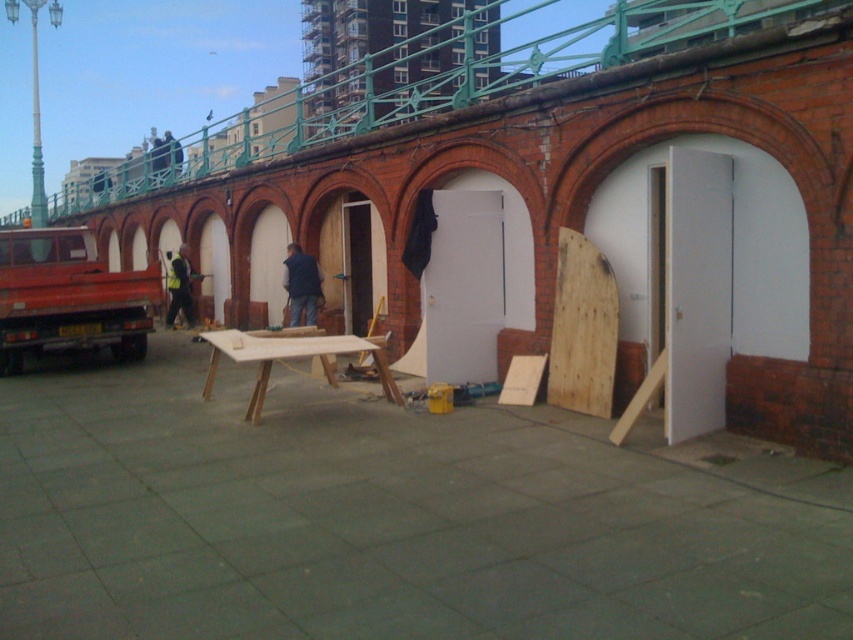
You are a construction worker who just arrived at the site and need to locate your safety gear. You see the dark blue jacket at center and the reflective yellow safety vest at center. Which item is positioned to the right of the other?

The dark blue jacket at center is to the right of the reflective yellow safety vest at center.

You are a contractor assessing the space between two structures in the image. The white matte door at center and the wooden at center are positioned close to each other. Which object has a greater width?

The white matte door at center has a greater width than the wooden at center, as stated in the description.